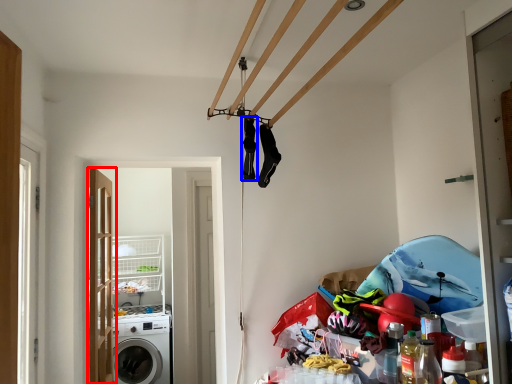
Question: Which object appears farthest to the camera in this image, door (highlighted by a red box) or clothing (highlighted by a blue box)?

Choices:
 (A) door
 (B) clothing

Answer: (A)